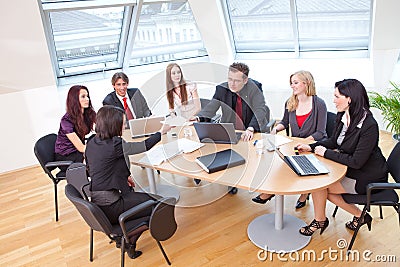
You are a GUI agent. You are given a task and a screenshot of the screen. Output one action in this format:
    pyautogui.click(x=<x>, y=<y>)
    Task: Click on the table posts
    This screenshot has width=400, height=267.
    Given the screenshot: What is the action you would take?
    277,222, 151,187